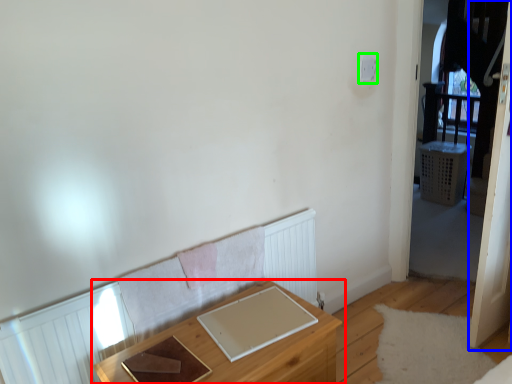
Question: Which object is the closest to the table (highlighted by a red box)? Choose among these: screen door (highlighted by a blue box) or light switch (highlighted by a green box).

Choices:
 (A) screen door
 (B) light switch

Answer: (A)